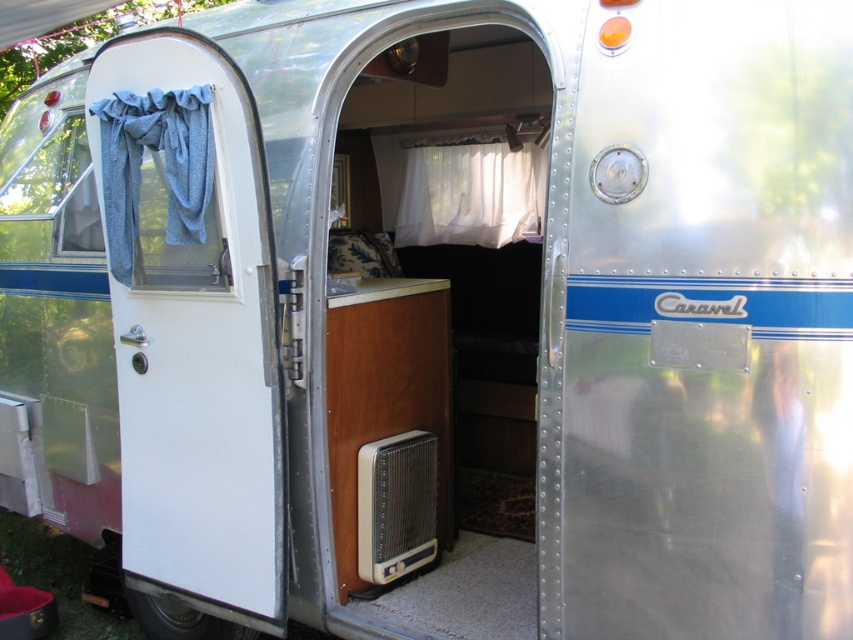
You are standing outside the Caravel trailer and want to enter. Where is the white matte door at center located in relation to the trailer?

The white matte door at center is located at point [433,305] on the trailer.

You are standing outside the Caravel trailer and want to enter. Where is the door located relative to the point marked at coordinates point (433, 305)?

The door is at the center, so the point marked at coordinates point (433, 305) is on the white matte door at center.